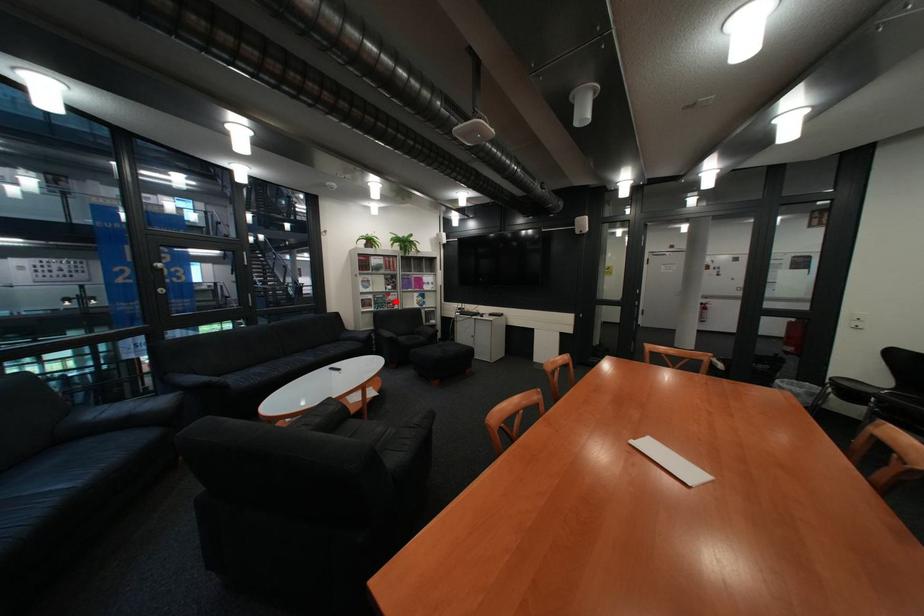
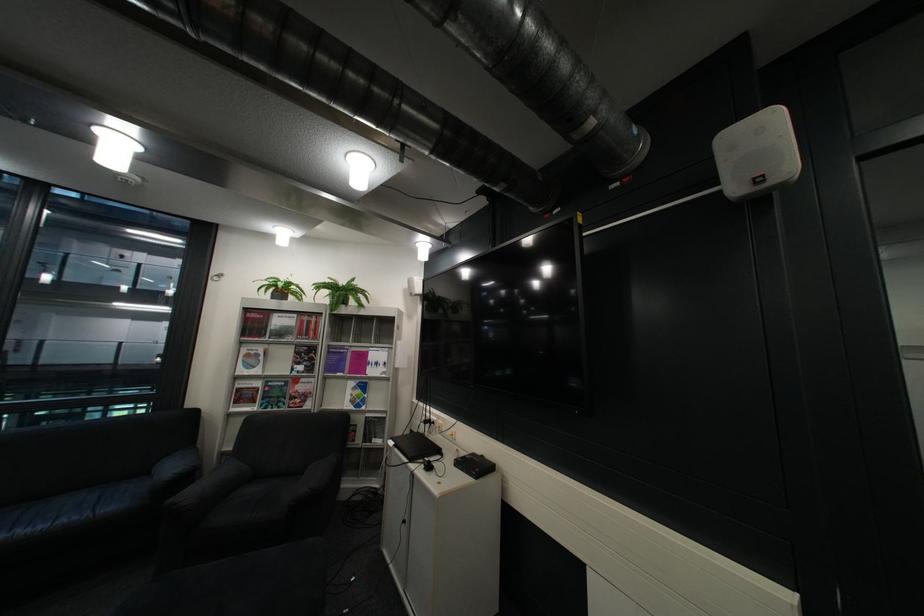
Question: I am providing you with two images of the same scene from different viewpoints. A red point is marked on the first image. Is the red point's position out of view in image 2?

Choices:
 (A) Yes
 (B) No

Answer: (B)